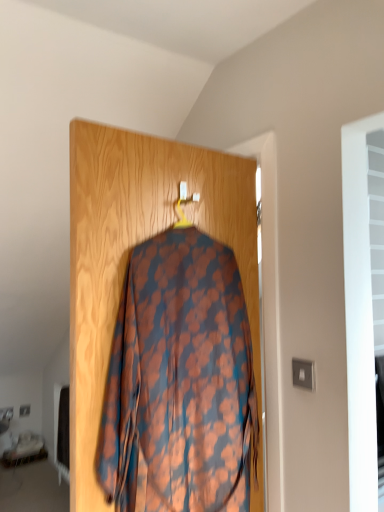
Describe the element at coordinates (180, 381) in the screenshot. I see `floral-patterned fabric at center` at that location.

In order to click on floral-patterned fabric at center in this screenshot , I will do click(180, 381).

This screenshot has width=384, height=512. Identify the location of floral-patterned fabric at center. (180, 381).